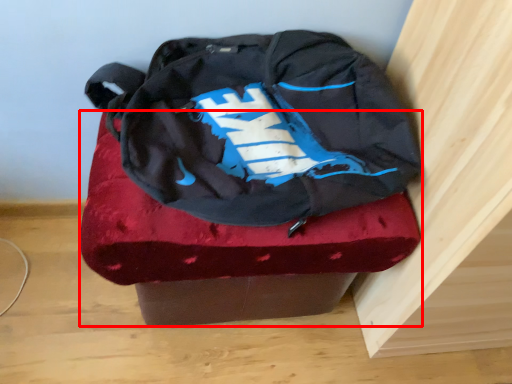
Question: From the image's perspective, where is furniture (annotated by the red box) located in relation to backpack in the image?

Choices:
 (A) above
 (B) below

Answer: (B)